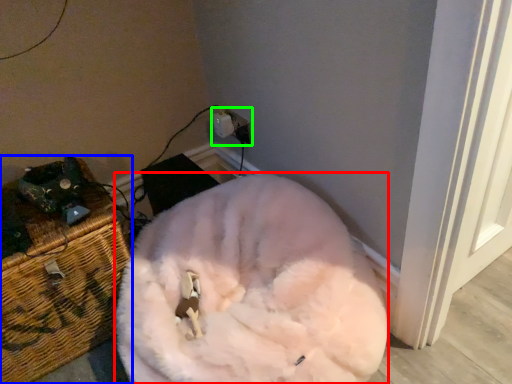
Question: Considering the real-world distances, which object is farthest from animal (highlighted by a red box)? furniture (highlighted by a blue box) or electric outlet (highlighted by a green box)?

Choices:
 (A) furniture
 (B) electric outlet

Answer: (B)